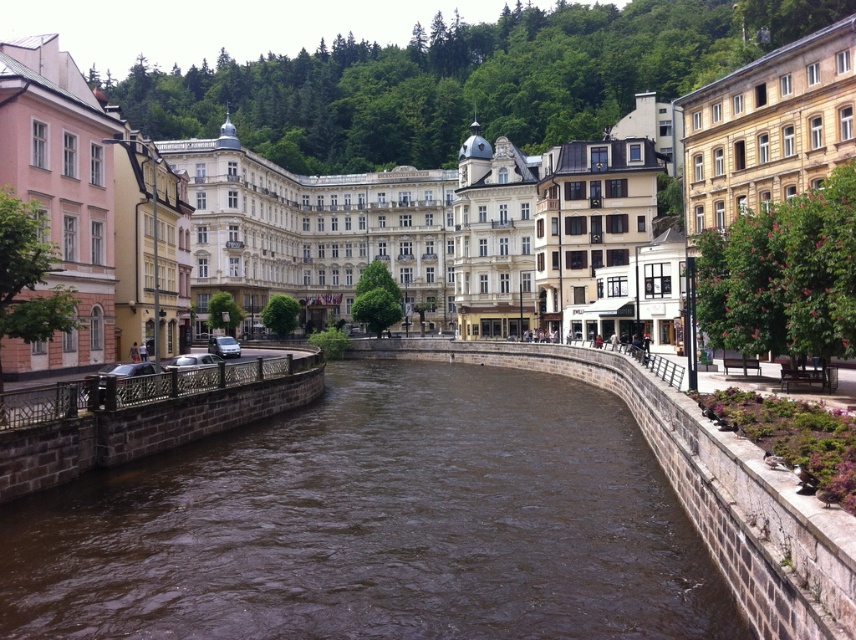
Question: Where is brown stone river at center located in relation to brown stone buildings at center in the image?

Choices:
 (A) left
 (B) right

Answer: (B)

Question: Is brown stone river at center wider than brown stone buildings at center?

Choices:
 (A) no
 (B) yes

Answer: (A)

Question: Can you confirm if brown stone river at center is positioned to the left of brown stone buildings at center?

Choices:
 (A) no
 (B) yes

Answer: (A)

Question: Which point is farther to the camera?

Choices:
 (A) brown stone buildings at center
 (B) brown stone river at center

Answer: (A)

Question: Among these objects, which one is nearest to the camera?

Choices:
 (A) brown stone buildings at center
 (B) brown stone river at center

Answer: (B)